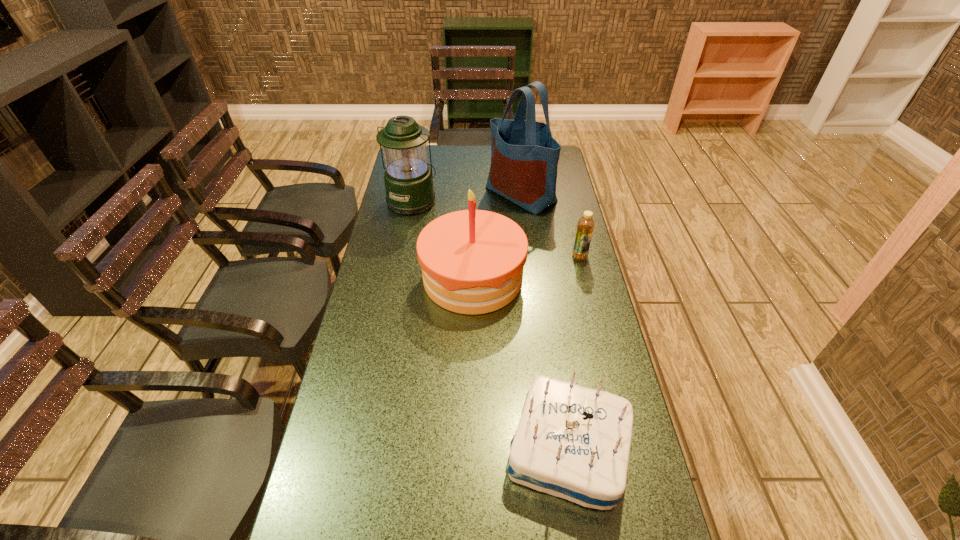
Find the location of a particular element. Image resolution: width=960 pixels, height=540 pixels. vacant area that lies between the lantern and the nearer birthday cake is located at coordinates (491, 325).

The width and height of the screenshot is (960, 540). Identify the location of vacant area between the bottle and the tallest object. (550, 225).

Identify which object is the fourth nearest to the lantern. Please provide its 2D coordinates. Your answer should be formatted as a tuple, i.e. [(x, y)], where the tuple contains the x and y coordinates of a point satisfying the conditions above.

[(572, 442)]

Identify the location of object that stands as the fourth closest to the lantern. (572, 442).

Locate an element on the screen. This screenshot has height=540, width=960. blank space that satisfies the following two spatial constraints: 1. on the front side of the lantern; 2. on the left side of the nearest object is located at coordinates (365, 450).

Locate an element on the screen. The width and height of the screenshot is (960, 540). vacant region that satisfies the following two spatial constraints: 1. on the front side of the lantern; 2. on the right side of the nearest object is located at coordinates (365, 450).

Find the location of a particular element. The width and height of the screenshot is (960, 540). vacant area in the image that satisfies the following two spatial constraints: 1. on the back side of the taller birthday cake; 2. on the right side of the shortest object is located at coordinates (473, 256).

Image resolution: width=960 pixels, height=540 pixels. Identify the location of vacant space that satisfies the following two spatial constraints: 1. on the back side of the taller birthday cake; 2. on the right side of the handbag. (474, 194).